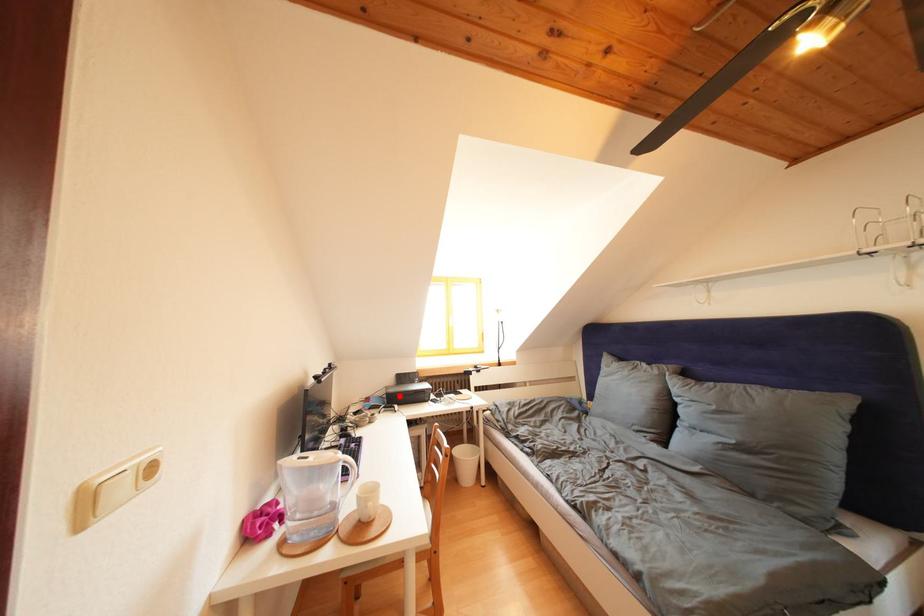
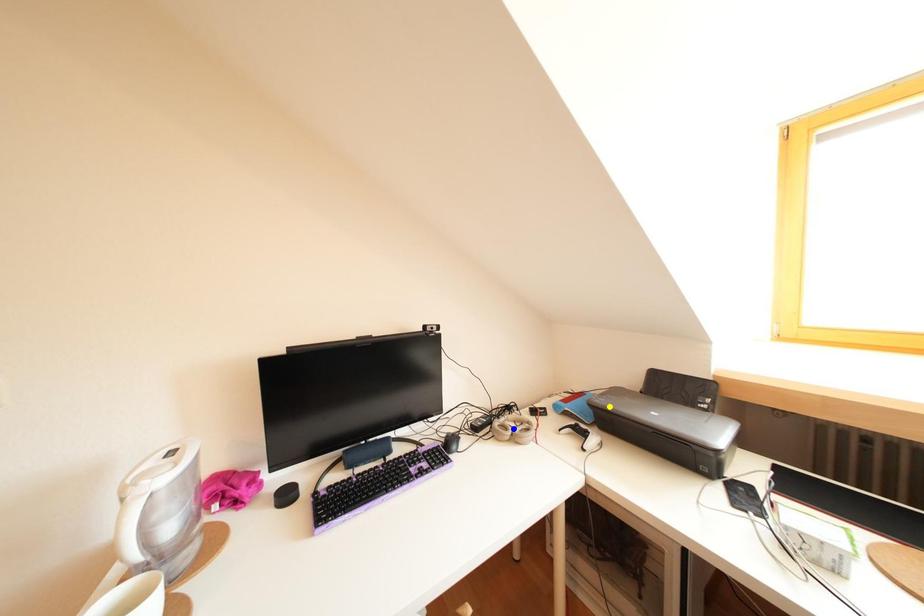
Question: I am providing you with two images of the same scene from different viewpoints. A red point is marked on the first image. You are given multiple points on the second image. Which spot in image 2 lines up with the point in image 1?

Choices:
 (A) green point
 (B) yellow point
 (C) blue point

Answer: (B)